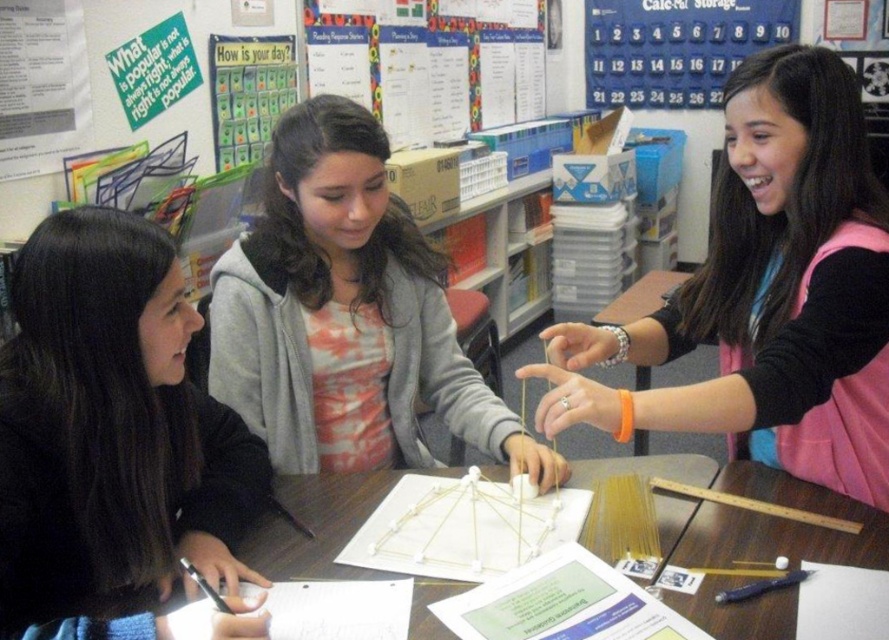
Is gray hoodie at center below white paperboard at upper center?

Correct, gray hoodie at center is located below white paperboard at upper center.

Does gray hoodie at center appear on the left side of white paperboard at upper center?

Correct, you'll find gray hoodie at center to the left of white paperboard at upper center.

Locate an element on the screen. The width and height of the screenshot is (889, 640). gray hoodie at center is located at coordinates (346, 316).

Identify the location of gray hoodie at center. The height and width of the screenshot is (640, 889). (346, 316).

Between wooden table at center and white paperboard at upper center, which one is positioned lower?

wooden table at center

Is wooden table at center thinner than white paperboard at upper center?

Indeed, wooden table at center has a lesser width compared to white paperboard at upper center.

Does point (303, 508) lie in front of point (407, 116)?

That is True.

I want to click on wooden table at center, so click(745, 515).

Does point (74, 608) lie in front of point (883, 564)?

That is True.

Can you confirm if black matte jacket at left is taller than wooden table at center?

Yes, black matte jacket at left is taller than wooden table at center.

Is point (107, 237) positioned before point (725, 474)?

Yes.

What are the coordinates of `black matte jacket at left` in the screenshot? It's located at (110, 436).